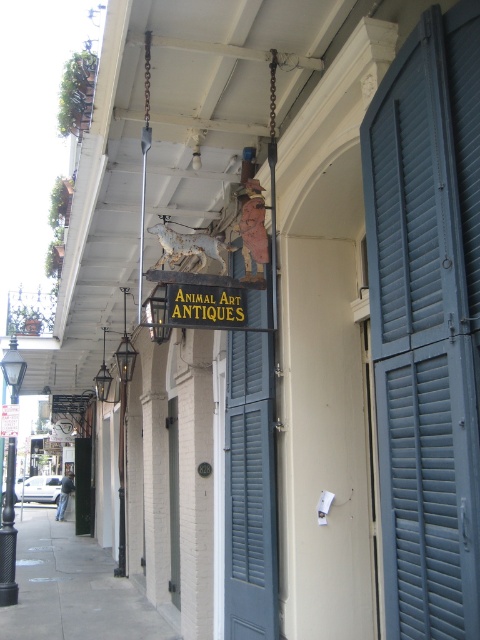
You are standing in front of the building with the sign that says ANIMAL ART ANTIQUES. You need to locate the blue painted wood shutters at right. According to the coordinates provided, where exactly are they positioned?

The blue painted wood shutters at right are positioned at point (427, 323).

You are standing on the street looking at the building with the sign. Where are the blue painted wood shutters at right located in relation to the sign?

The blue painted wood shutters at right are located at the point (427, 323) in 2D coordinates, which places them to the right side of the sign.

You are a delivery person who needs to place a large package on the gray concrete sidewalk at lower left or the gold metallic sign at center. Which location can accommodate the package better?

The gray concrete sidewalk at lower left is bigger than the gold metallic sign at center, so the package will fit better on the gray concrete sidewalk at lower left.